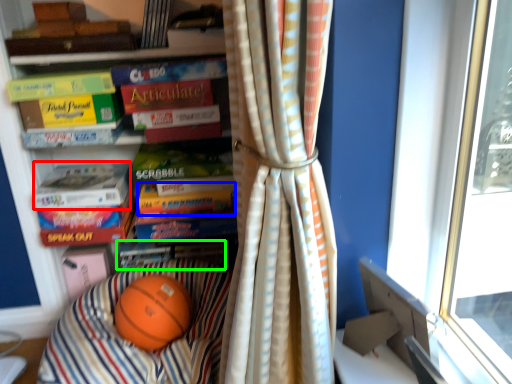
Question: Based on their relative distances, which object is nearer to paperback book (highlighted by a red box)? Choose from paperback book (highlighted by a blue box) and book (highlighted by a green box).

Choices:
 (A) paperback book
 (B) book

Answer: (A)